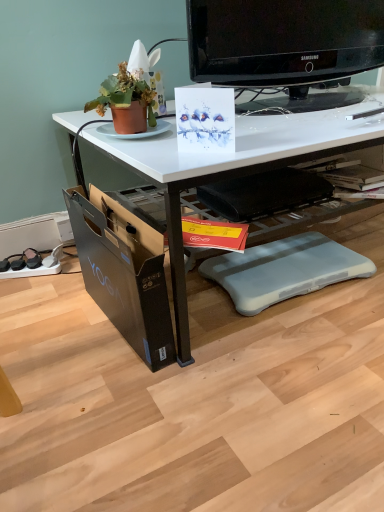
Question: In the image, is black cardboard file cabinet at lower left on the left side or the right side of terracotta clay pot at upper left?

Choices:
 (A) right
 (B) left

Answer: (B)

Question: From a real-world perspective, is black cardboard file cabinet at lower left above or below terracotta clay pot at upper left?

Choices:
 (A) above
 (B) below

Answer: (B)

Question: Which is farther from the gray plastic swivel chair at lower center, placed as the second swivel chair when sorted from top to bottom?

Choices:
 (A) terracotta clay pot at upper left
 (B) yellow paper magazine at center
 (C) white glossy desk at center
 (D) black plastic swivel chair at center, the 2th swivel chair when ordered from bottom to top
 (E) black glossy television at upper center

Answer: (A)

Question: Which is nearer to the yellow paper magazine at center?

Choices:
 (A) black glossy television at upper center
 (B) black cardboard file cabinet at lower left
 (C) white glossy desk at center
 (D) gray plastic swivel chair at lower center, the 1th swivel chair from the bottom
 (E) black plastic swivel chair at center, the 2th swivel chair when ordered from bottom to top

Answer: (E)